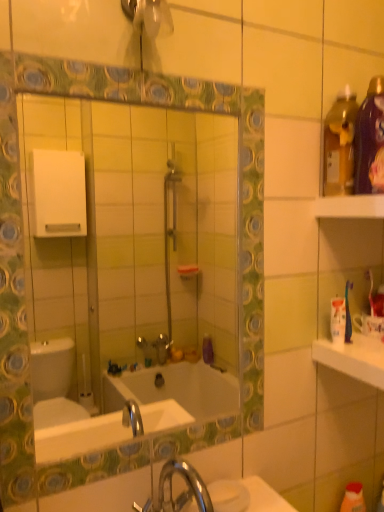
This screenshot has width=384, height=512. I want to click on white glossy countertop at right, so click(353, 358).

Find the location of `white plastic shelf at upper right`. white plastic shelf at upper right is located at coordinates (350, 207).

Locate an element on the screen. Image resolution: width=384 pixels, height=512 pixels. white glossy countertop at right is located at coordinates (353, 358).

Consider the image. From the image's perspective, which one is positioned lower, green glossy mirror at center or white glossy countertop at right?

From the image's view, white glossy countertop at right is below.

How different are the orientations of green glossy mirror at center and white glossy countertop at right in degrees?

The angle between the facing direction of green glossy mirror at center and the facing direction of white glossy countertop at right is 0.0847 degrees.

Is green glossy mirror at center taller or shorter than white glossy countertop at right?

Clearly, green glossy mirror at center is taller compared to white glossy countertop at right.

Between green glossy mirror at center and white glossy countertop at right, which one is positioned behind?

white glossy countertop at right is further away from the camera.

Looking at their sizes, would you say white glossy countertop at right is wider or thinner than green glossy mirror at center?

Clearly, white glossy countertop at right has more width compared to green glossy mirror at center.

From the image's perspective, does white glossy countertop at right appear lower than green glossy mirror at center?

Indeed, from the image's perspective, white glossy countertop at right is shown beneath green glossy mirror at center.

Which is correct: white glossy countertop at right is inside green glossy mirror at center, or outside of it?

white glossy countertop at right is not enclosed by green glossy mirror at center.

Would you say white glossy countertop at right is to the left or to the right of green glossy mirror at center in the picture?

Based on their positions, white glossy countertop at right is located to the right of green glossy mirror at center.

From the picture: Who is smaller, white glossy countertop at right or white plastic shelf at upper right?

Smaller between the two is white plastic shelf at upper right.

Do you think white glossy countertop at right is within white plastic shelf at upper right, or outside of it?

white glossy countertop at right is not enclosed by white plastic shelf at upper right.

Based on the photo, does white glossy countertop at right lie behind white plastic shelf at upper right?

Yes.

Is white glossy countertop at right to the right of white plastic shelf at upper right from the viewer's perspective?

Correct, you'll find white glossy countertop at right to the right of white plastic shelf at upper right.

Considering the relative positions of white plastic shelf at upper right and white glossy countertop at right in the image provided, is white plastic shelf at upper right to the left or to the right of white glossy countertop at right?

white plastic shelf at upper right is positioned on white glossy countertop at right's left side.

Is white plastic shelf at upper right oriented towards white glossy countertop at right?

No, white plastic shelf at upper right is not oriented towards white glossy countertop at right.

Who is more distant, green glossy mirror at center or white plastic shelf at upper right?

white plastic shelf at upper right.

Does point (99, 164) come in front of point (373, 210)?

No.

Between green glossy mirror at center and white plastic shelf at upper right, which one has smaller size?

With smaller size is white plastic shelf at upper right.

Would you say green glossy mirror at center is outside white plastic shelf at upper right?

Absolutely, green glossy mirror at center is external to white plastic shelf at upper right.

From a real-world perspective, which is physically below, white plastic shelf at upper right or green glossy mirror at center?

green glossy mirror at center is physically lower.

Is point (350, 197) closer to viewer compared to point (44, 303)?

Yes, point (350, 197) is closer to viewer.

Is white plastic shelf at upper right outside of green glossy mirror at center?

Yes, white plastic shelf at upper right is not within green glossy mirror at center.

Between white plastic shelf at upper right and green glossy mirror at center, which one has less height?

white plastic shelf at upper right.

At what (x,y) coordinates should I click in order to perform the action: click on mirror above the white glossy countertop at right (from a real-world perspective). Please return your answer as a coordinate pair (x, y). The width and height of the screenshot is (384, 512). Looking at the image, I should click on (143, 246).

You are a GUI agent. You are given a task and a screenshot of the screen. Output one action in this format:
    pyautogui.click(x=<x>, y=<y>)
    Task: Click on the mirror lying on the left of white glossy countertop at right
    The image size is (384, 512).
    Given the screenshot: What is the action you would take?
    pyautogui.click(x=143, y=246)

When comparing their distances from white glossy countertop at right, does white plastic shelf at upper right or green glossy mirror at center seem closer?

Based on the image, white plastic shelf at upper right appears to be nearer to white glossy countertop at right.

Considering their positions, is green glossy mirror at center positioned further to white plastic shelf at upper right than white glossy countertop at right?

Based on the image, green glossy mirror at center appears to be further to white plastic shelf at upper right.

Which object lies further to the anchor point white plastic shelf at upper right, white glossy countertop at right or green glossy mirror at center?

green glossy mirror at center.

When comparing their distances from green glossy mirror at center, does white glossy countertop at right or white plastic shelf at upper right seem further?

white plastic shelf at upper right lies further to green glossy mirror at center than the other object.

When comparing their distances from white glossy countertop at right, does green glossy mirror at center or white plastic shelf at upper right seem closer?

white plastic shelf at upper right lies closer to white glossy countertop at right than the other object.

Based on their spatial positions, is white plastic shelf at upper right or white glossy countertop at right closer to green glossy mirror at center?

Based on the image, white glossy countertop at right appears to be nearer to green glossy mirror at center.

I want to click on shelf situated between green glossy mirror at center and white glossy countertop at right from left to right, so click(x=350, y=207).